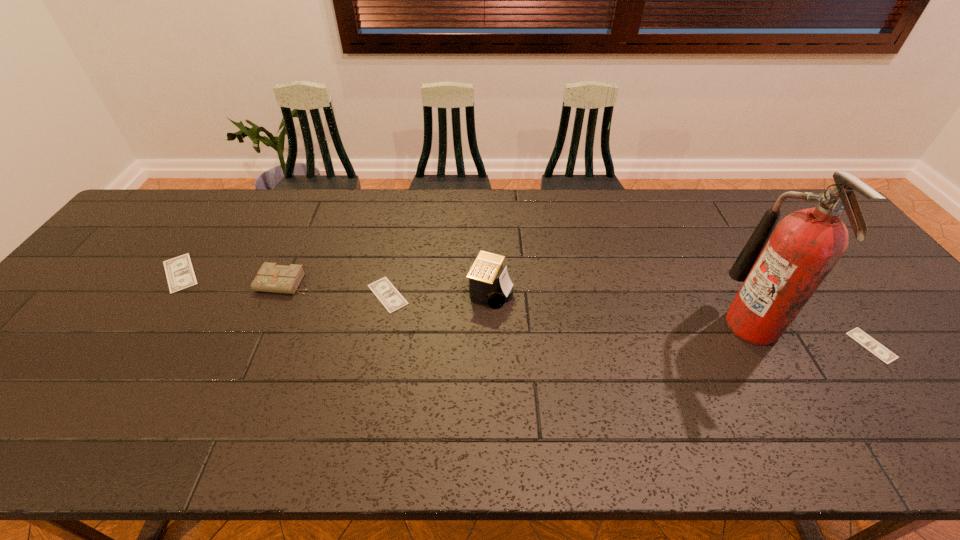
Image resolution: width=960 pixels, height=540 pixels. What are the coordinates of `the leftmost object` in the screenshot? It's located at (x=180, y=275).

Identify the location of the tallest money. (180, 275).

Locate an element on the screen. This screenshot has width=960, height=540. the second money from left to right is located at coordinates (392, 300).

Locate an element on the screen. the second tallest money is located at coordinates (392, 300).

Where is `the nearest money`? the nearest money is located at coordinates (858, 335).

Where is `the shortest money`? the shortest money is located at coordinates (858, 335).

Identify the location of the fifth object from right to left. (271, 277).

Identify the location of the fourth shortest object. The width and height of the screenshot is (960, 540). 271,277.

Where is `calculator`? calculator is located at coordinates (489, 285).

Locate an element on the screen. This screenshot has width=960, height=540. the fifth shortest object is located at coordinates [489, 285].